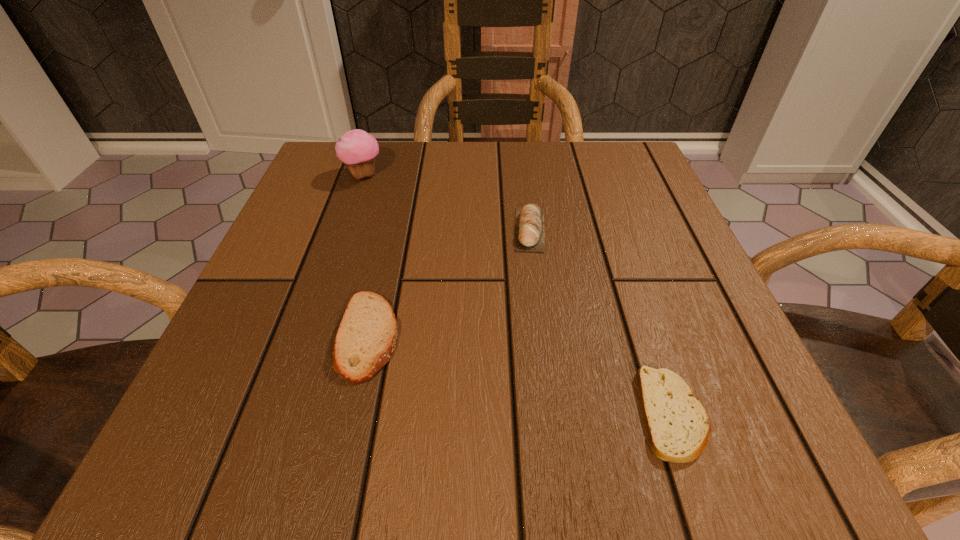
The image size is (960, 540). In order to click on the leftmost object in this screenshot , I will do `click(356, 148)`.

The width and height of the screenshot is (960, 540). I want to click on cupcake, so click(356, 148).

Locate an element on the screen. This screenshot has height=540, width=960. the second object from right to left is located at coordinates (529, 228).

Image resolution: width=960 pixels, height=540 pixels. Identify the location of the third nearest object. (529, 228).

Where is `the second object from left to right`? The image size is (960, 540). the second object from left to right is located at coordinates (366, 338).

Locate an element on the screen. the leftmost pita bread is located at coordinates (366, 338).

Where is `the shortest object`? the shortest object is located at coordinates (677, 424).

I want to click on the shortest pita bread, so click(677, 424).

You are a GUI agent. You are given a task and a screenshot of the screen. Output one action in this format:
    pyautogui.click(x=<x>, y=<y>)
    Task: Click on the free region located on the right of the tallest object
    This screenshot has width=960, height=540.
    Given the screenshot: What is the action you would take?
    pyautogui.click(x=503, y=176)

Locate an element on the screen. The image size is (960, 540). vacant space located on the left of the second pita bread from right to left is located at coordinates tap(421, 229).